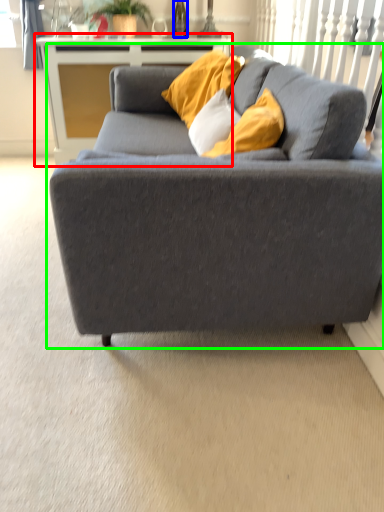
Question: Which is farther away from table (highlighted by a red box)? wine bottle (highlighted by a blue box) or studio couch (highlighted by a green box)?

Choices:
 (A) wine bottle
 (B) studio couch

Answer: (B)